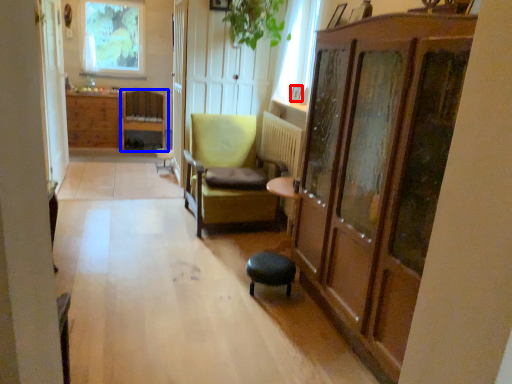
Question: Which of the following is the farthest to the observer, picture frame (highlighted by a red box) or chair (highlighted by a blue box)?

Choices:
 (A) picture frame
 (B) chair

Answer: (B)